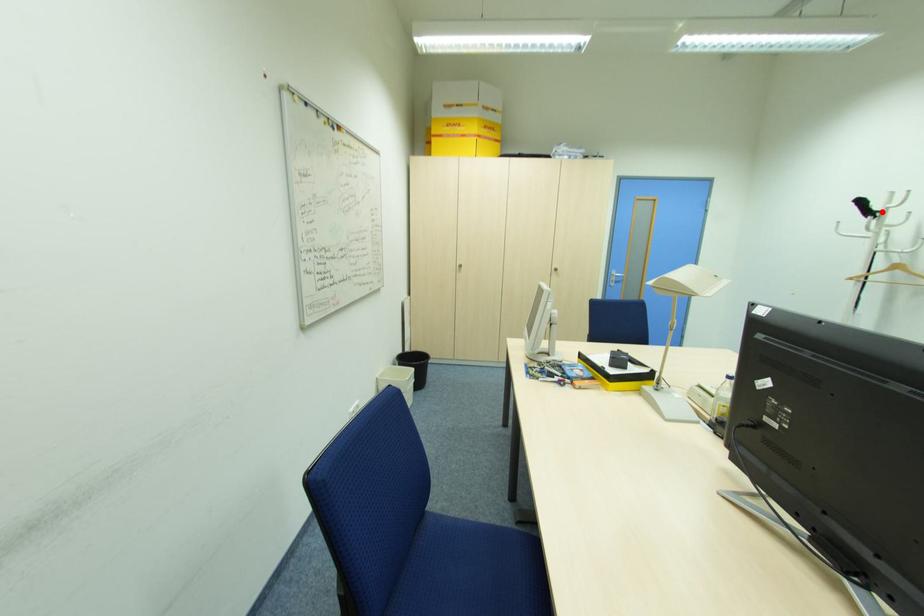
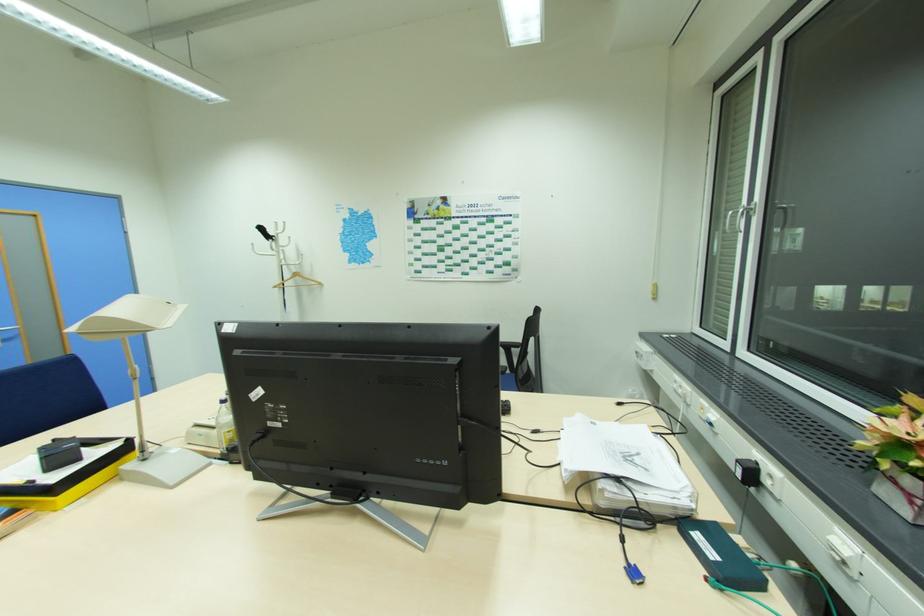
Question: I am providing you with two images of the same scene from different viewpoints. Given a red point in image1, look at the same physical point in image2. Is it:

Choices:
 (A) Closer to the viewpoint
 (B) Farther from the viewpoint

Answer: (A)